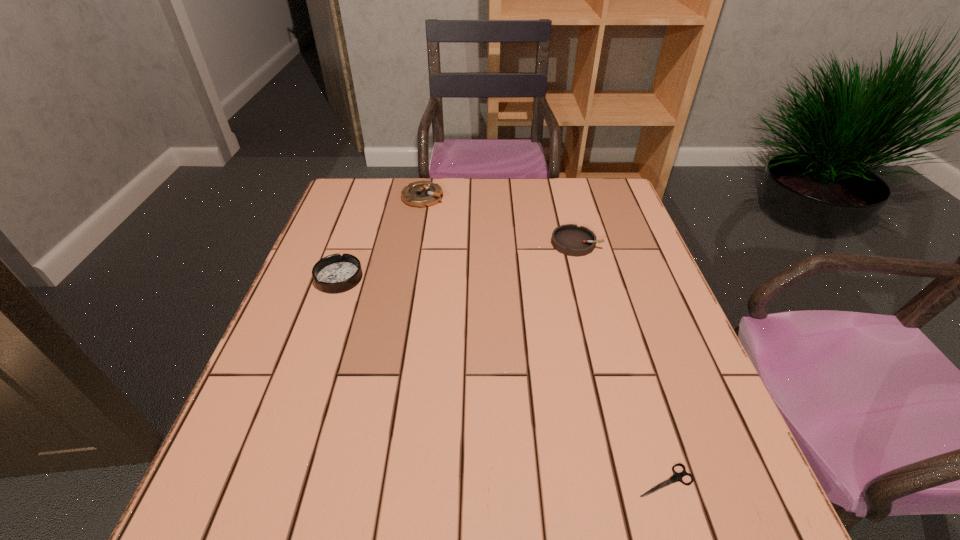
Locate an element on the screen. vacant region that satisfies the following two spatial constraints: 1. on the front side of the nearest ashtray; 2. on the right side of the shears is located at coordinates (268, 480).

The height and width of the screenshot is (540, 960). In order to click on free location that satisfies the following two spatial constraints: 1. on the back side of the leftmost object; 2. on the left side of the second farthest object in this screenshot , I will do `click(351, 243)`.

Where is `blank area in the image that satisfies the following two spatial constraints: 1. on the front side of the second ashtray from left to right; 2. on the right side of the shortest object`? blank area in the image that satisfies the following two spatial constraints: 1. on the front side of the second ashtray from left to right; 2. on the right side of the shortest object is located at coordinates (372, 480).